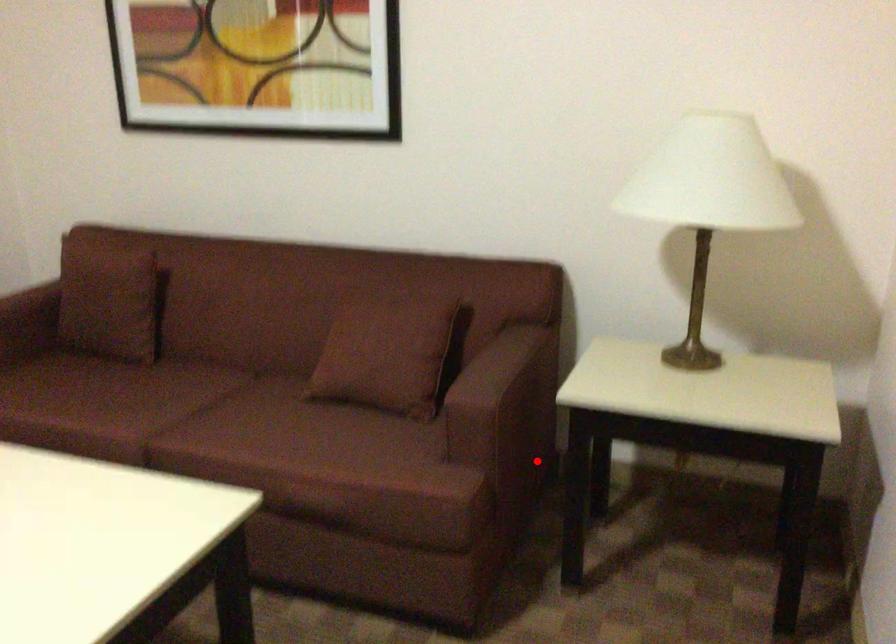
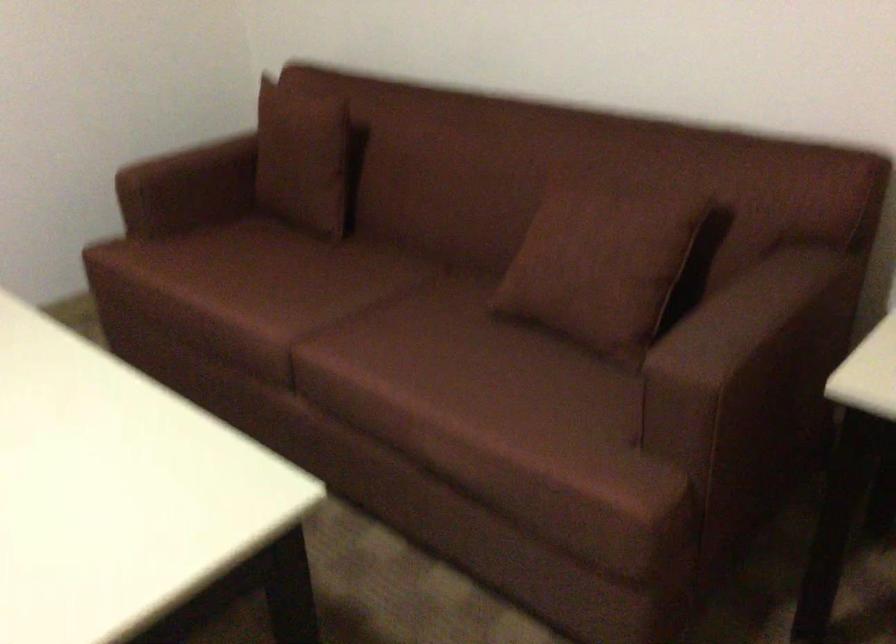
Question: I am providing you with two images of the same scene from different viewpoints. In image1, a red point is highlighted. Considering the same 3D point in image2, which of the following is correct?

Choices:
 (A) It is closer
 (B) It is farther

Answer: (A)